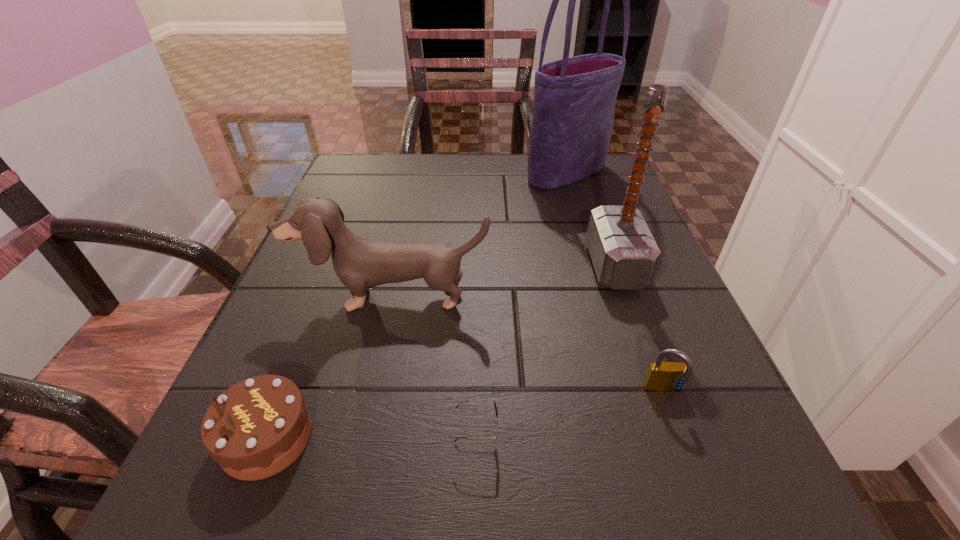
Find the location of a particular element. Image resolution: width=960 pixels, height=540 pixels. the tallest object is located at coordinates pos(574,98).

I want to click on the farthest object, so click(x=574, y=98).

Where is `hammer`? hammer is located at coordinates (624, 254).

In order to click on the fourth shortest object in this screenshot , I will do `click(359, 263)`.

Find the location of a particular element. This screenshot has width=960, height=540. padlock is located at coordinates 661,376.

The width and height of the screenshot is (960, 540). What are the coordinates of `chocolate cake` in the screenshot? It's located at (258, 427).

Locate an element on the screen. The image size is (960, 540). the shortest object is located at coordinates (496, 406).

Locate an element on the screen. This screenshot has width=960, height=540. free space located 0.160m on the left of the tallest object is located at coordinates (461, 173).

The height and width of the screenshot is (540, 960). Identify the location of vacant space located on the striking surface of the hammer. (393, 266).

This screenshot has width=960, height=540. What are the coordinates of `vacant point located 0.360m on the striking surface of the hammer` in the screenshot? It's located at (397, 266).